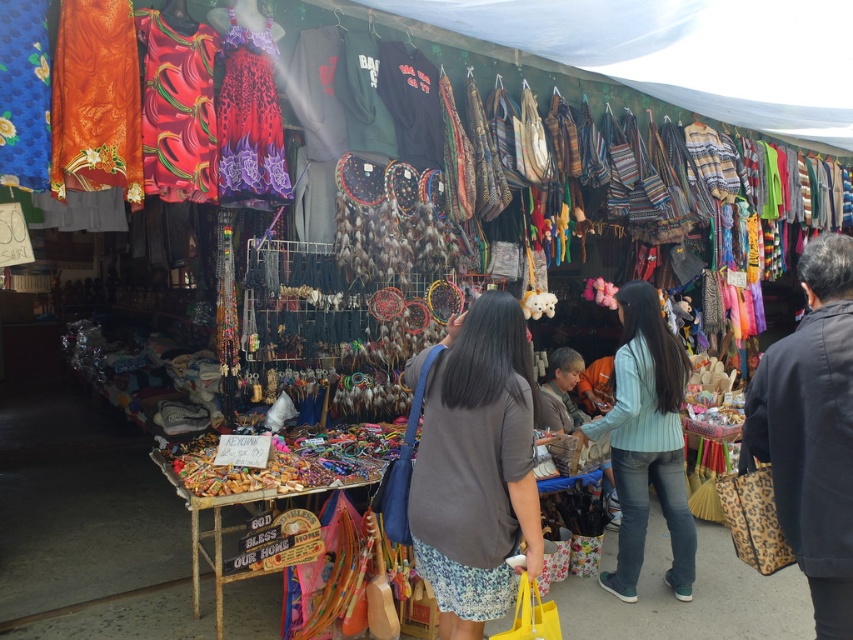
Question: Is dark gray shirt at center to the left of light blue striped shirt at center from the viewer's perspective?

Choices:
 (A) yes
 (B) no

Answer: (A)

Question: Is dark gray shirt at center closer to the viewer compared to light blue striped shirt at center?

Choices:
 (A) no
 (B) yes

Answer: (B)

Question: Which point appears farthest from the camera in this image?

Choices:
 (A) (496, 296)
 (B) (672, 545)

Answer: (B)

Question: Does dark gray shirt at center have a lesser width compared to light blue striped shirt at center?

Choices:
 (A) no
 (B) yes

Answer: (B)